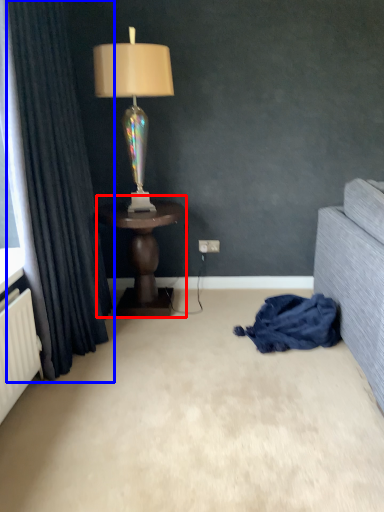
Question: Which point is further to the camera, table (highlighted by a red box) or curtain (highlighted by a blue box)?

Choices:
 (A) table
 (B) curtain

Answer: (A)